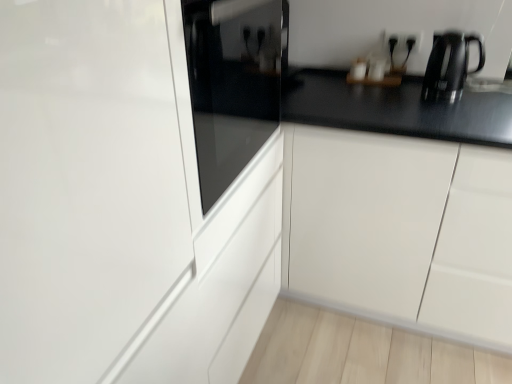
Where is `black metallic kettle at upper right`? The image size is (512, 384). black metallic kettle at upper right is located at coordinates (450, 65).

At what (x,y) coordinates should I click in order to perform the action: click on glossy white glass door at center. Please return your answer as a coordinate pair (x, y). The width and height of the screenshot is (512, 384). Looking at the image, I should click on (85, 184).

What are the coordinates of `glossy white cabinet at center` in the screenshot? It's located at (400, 230).

At what (x,y) coordinates should I click in order to perform the action: click on black plastic electric outlet at upper right. Please return your answer as a coordinate pair (x, y). The height and width of the screenshot is (384, 512). Looking at the image, I should click on (403, 40).

Is glossy white glass door at center not close to glossy white cabinet at center?

Absolutely, glossy white glass door at center is distant from glossy white cabinet at center.

Is glossy white cabinet at center surrounded by glossy white glass door at center?

No, glossy white cabinet at center is not surrounded by glossy white glass door at center.

What's the angular difference between glossy white glass door at center and glossy white cabinet at center's facing directions?

90 degrees separate the facing orientations of glossy white glass door at center and glossy white cabinet at center.

Where is `cabinetry that appears behind the glossy white glass door at center`? cabinetry that appears behind the glossy white glass door at center is located at coordinates (400, 230).

How many degrees apart are the facing directions of black metallic kettle at upper right and glossy white cabinet at center?

The angular difference between black metallic kettle at upper right and glossy white cabinet at center is 1.47 degrees.

Consider the image. Is black metallic kettle at upper right thinner than glossy white cabinet at center?

Yes.

Is black metallic kettle at upper right at the right side of glossy white cabinet at center?

Yes, black metallic kettle at upper right is to the right of glossy white cabinet at center.

Is black metallic kettle at upper right bigger than glossy white cabinet at center?

No.

From a real-world perspective, which object rests below the other?

glossy white cabinet at center, from a real-world perspective.

Who is bigger, black plastic electric outlet at upper right or glossy white cabinet at center?

Bigger between the two is glossy white cabinet at center.

Is black plastic electric outlet at upper right closer to camera compared to glossy white cabinet at center?

No, black plastic electric outlet at upper right is further to the viewer.

How different are the orientations of black plastic electric outlet at upper right and glossy white cabinet at center in degrees?

The angle between the facing direction of black plastic electric outlet at upper right and the facing direction of glossy white cabinet at center is 0.245 degrees.

Does black metallic kettle at upper right have a greater height compared to glossy white glass door at center?

Incorrect, the height of black metallic kettle at upper right is not larger of that of glossy white glass door at center.

Considering the relative sizes of black metallic kettle at upper right and glossy white glass door at center in the image provided, is black metallic kettle at upper right thinner than glossy white glass door at center?

Yes.

Is glossy white cabinet at center to the left or to the right of black plastic electric outlet at upper right in the image?

Clearly, glossy white cabinet at center is on the left of black plastic electric outlet at upper right in the image.

Who is shorter, glossy white cabinet at center or black plastic electric outlet at upper right?

With less height is black plastic electric outlet at upper right.

From the image's perspective, which one is positioned higher, glossy white cabinet at center or black plastic electric outlet at upper right?

black plastic electric outlet at upper right appears higher in the image.

In the image, there is a black plastic electric outlet at upper right. Where is `kitchen appliance below it (from the image's perspective)`? The height and width of the screenshot is (384, 512). kitchen appliance below it (from the image's perspective) is located at coordinates (450, 65).

Is black metallic kettle at upper right bigger or smaller than black plastic electric outlet at upper right?

Clearly, black metallic kettle at upper right is larger in size than black plastic electric outlet at upper right.

Between black metallic kettle at upper right and black plastic electric outlet at upper right, which one has more height?

With more height is black metallic kettle at upper right.

Based on the photo, in terms of width, does glossy white cabinet at center look wider or thinner when compared to glossy white glass door at center?

In the image, glossy white cabinet at center appears to be wider than glossy white glass door at center.

Considering the points (450, 312) and (62, 64), which point is in front, point (450, 312) or point (62, 64)?

The point (62, 64) is closer to the camera.

Consider the image. Would you say glossy white cabinet at center is outside glossy white glass door at center?

Yes.

Locate an element on the screen. Image resolution: width=512 pixels, height=384 pixels. cabinetry behind the glossy white glass door at center is located at coordinates (400, 230).

In order to click on kitchen appliance lying above the glossy white cabinet at center (from the image's perspective) in this screenshot , I will do `click(450, 65)`.

Looking at the image, which one is located closer to black plastic electric outlet at upper right, black metallic kettle at upper right or glossy white cabinet at center?

Among the two, black metallic kettle at upper right is located nearer to black plastic electric outlet at upper right.

Looking at the image, which one is located further to black metallic kettle at upper right, glossy white glass door at center or black plastic electric outlet at upper right?

glossy white glass door at center is further to black metallic kettle at upper right.

Estimate the real-world distances between objects in this image. Which object is further from black metallic kettle at upper right, glossy white cabinet at center or black plastic electric outlet at upper right?

The object further to black metallic kettle at upper right is glossy white cabinet at center.

Which object lies nearer to the anchor point glossy white glass door at center, black metallic kettle at upper right or black plastic electric outlet at upper right?

black metallic kettle at upper right.

Considering their positions, is glossy white cabinet at center positioned further to black plastic electric outlet at upper right than glossy white glass door at center?

glossy white glass door at center is further to black plastic electric outlet at upper right.

Which object lies further to the anchor point black plastic electric outlet at upper right, glossy white glass door at center or black metallic kettle at upper right?

glossy white glass door at center is further to black plastic electric outlet at upper right.

In the scene shown: When comparing their distances from glossy white glass door at center, does black metallic kettle at upper right or glossy white cabinet at center seem closer?

glossy white cabinet at center is closer to glossy white glass door at center.

When comparing their distances from glossy white cabinet at center, does glossy white glass door at center or black metallic kettle at upper right seem closer?

black metallic kettle at upper right.

Locate an element on the screen. The height and width of the screenshot is (384, 512). cabinetry between glossy white glass door at center and black metallic kettle at upper right is located at coordinates (400, 230).

I want to click on kitchen appliance positioned between glossy white glass door at center and black plastic electric outlet at upper right from near to far, so click(x=450, y=65).

Find the location of a particular element. The image size is (512, 384). cabinetry between glossy white glass door at center and black plastic electric outlet at upper right from front to back is located at coordinates (400, 230).

Locate an element on the screen. The width and height of the screenshot is (512, 384). kitchen appliance between black plastic electric outlet at upper right and glossy white cabinet at center in the up-down direction is located at coordinates (450, 65).